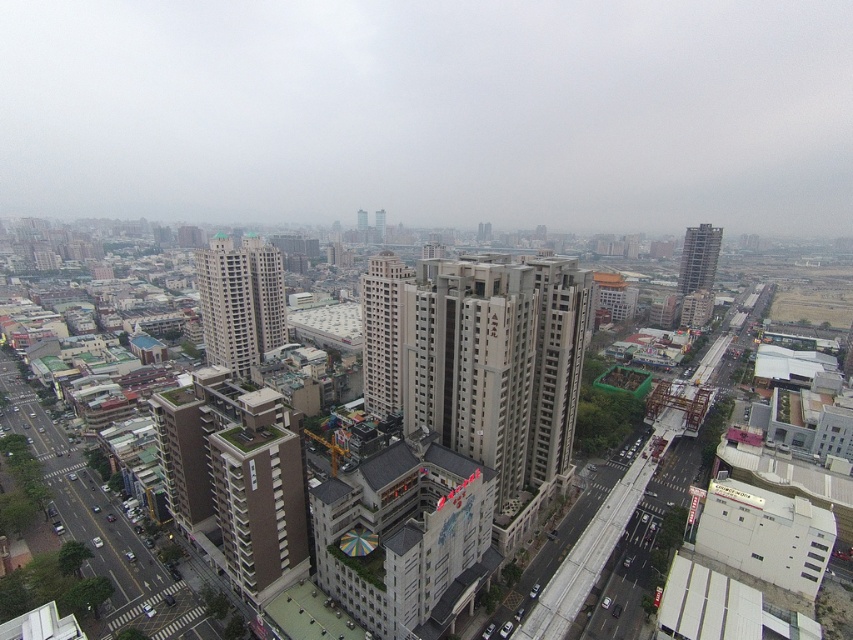
Who is higher up, beige concrete building at center-left or beige concrete building at center?

beige concrete building at center-left is above.

Describe the element at coordinates (241, 301) in the screenshot. I see `beige concrete building at center-left` at that location.

The height and width of the screenshot is (640, 853). I want to click on beige concrete building at center-left, so click(241, 301).

Is beige concrete building at center below gray concrete building at upper right?

Correct, beige concrete building at center is located below gray concrete building at upper right.

From the picture: Does beige concrete building at center come in front of gray concrete building at upper right?

That is True.

This screenshot has width=853, height=640. In order to click on beige concrete building at center in this screenshot , I will do `click(383, 333)`.

You are a GUI agent. You are given a task and a screenshot of the screen. Output one action in this format:
    pyautogui.click(x=<x>, y=<y>)
    Task: Click on the beige concrete building at center
    
    Given the screenshot: What is the action you would take?
    pyautogui.click(x=383, y=333)

Is point (247, 292) less distant than point (695, 257)?

Yes, it is in front of point (695, 257).

Who is shorter, beige concrete building at center-left or gray concrete building at upper right?

With less height is gray concrete building at upper right.

Find the location of a particular element. The height and width of the screenshot is (640, 853). beige concrete building at center-left is located at coordinates (241, 301).